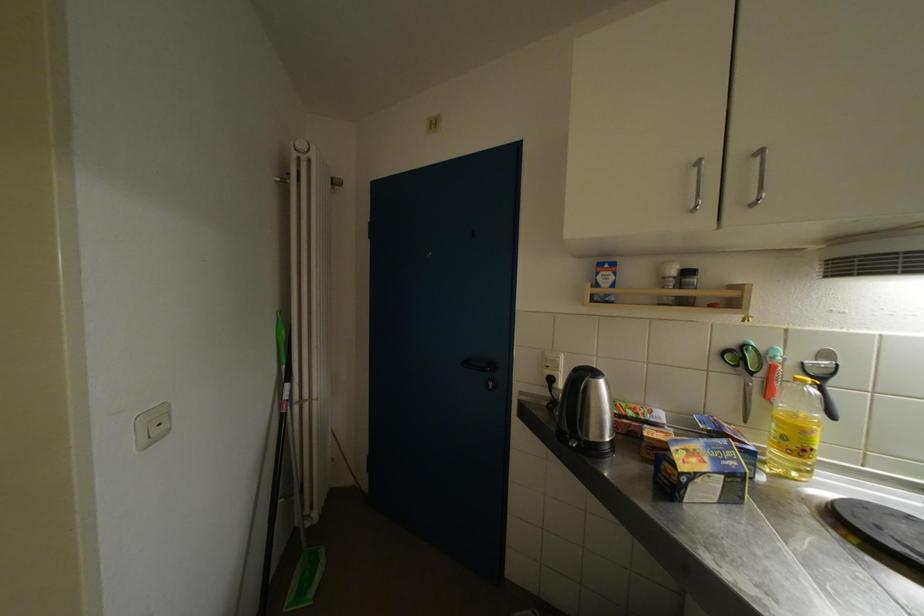
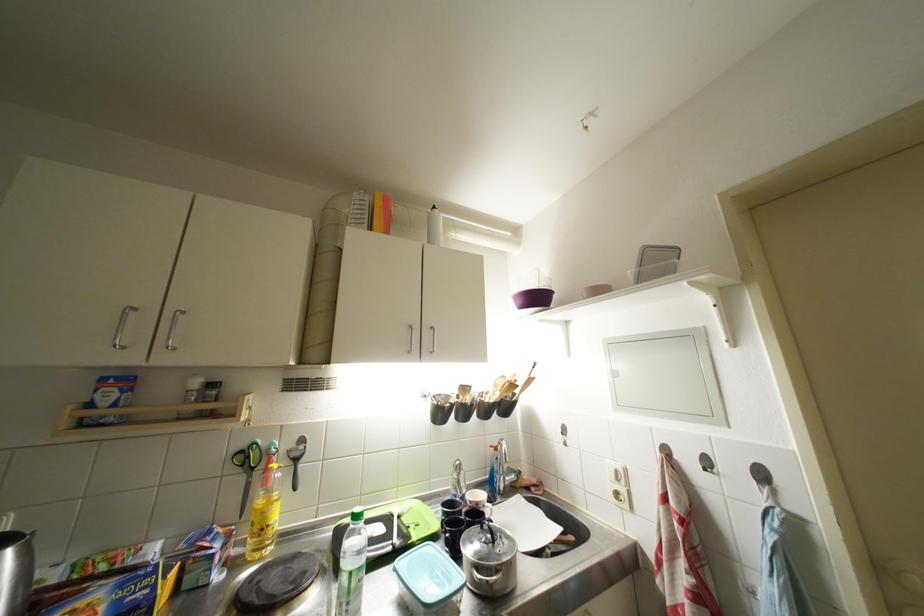
The point at (736, 347) is marked in the first image. Where is the corresponding point in the second image?

(249, 450)